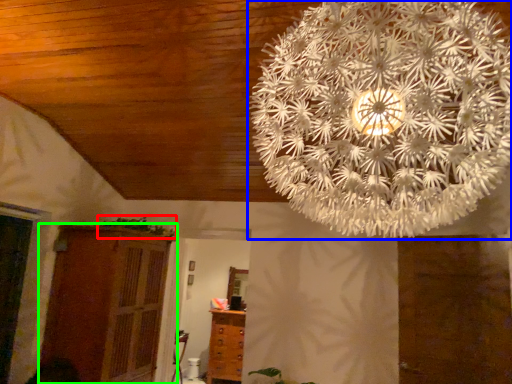
Question: Which object is positioned farthest from plant (highlighted by a red box)? Select from lamp (highlighted by a blue box) and cupboard (highlighted by a green box).

Choices:
 (A) lamp
 (B) cupboard

Answer: (A)